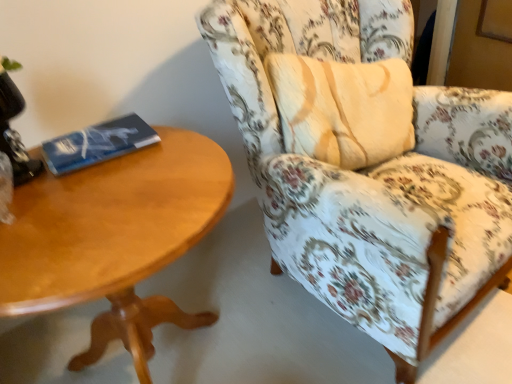
You are a GUI agent. You are given a task and a screenshot of the screen. Output one action in this format:
    pyautogui.click(x=<x>, y=<y>)
    Task: Click on the free spot in front of blue matte paperback book at left
    The image size is (512, 384).
    Given the screenshot: What is the action you would take?
    pyautogui.click(x=91, y=187)